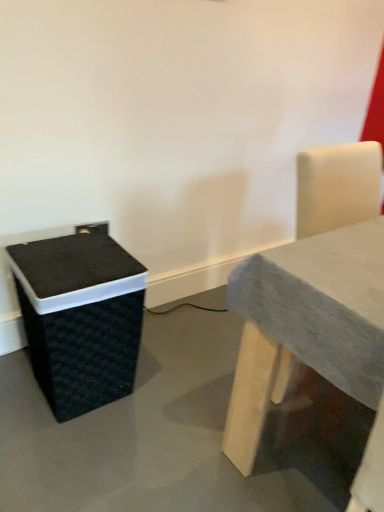
Question: From their relative heights in the image, would you say black woven basket at lower left is taller or shorter than gray fabric table at right?

Choices:
 (A) short
 (B) tall

Answer: (A)

Question: Looking at their shapes, would you say black woven basket at lower left is wider or thinner than gray fabric table at right?

Choices:
 (A) thin
 (B) wide

Answer: (A)

Question: From a real-world perspective, is black woven basket at lower left above or below gray fabric table at right?

Choices:
 (A) above
 (B) below

Answer: (B)

Question: From the image's perspective, is gray fabric table at right above or below black woven basket at lower left?

Choices:
 (A) below
 (B) above

Answer: (B)

Question: From a real-world perspective, is gray fabric table at right above or below black woven basket at lower left?

Choices:
 (A) above
 (B) below

Answer: (A)

Question: Would you say gray fabric table at right is to the left or to the right of black woven basket at lower left in the picture?

Choices:
 (A) left
 (B) right

Answer: (B)

Question: Is point (370, 404) closer or farther from the camera than point (72, 254)?

Choices:
 (A) farther
 (B) closer

Answer: (B)